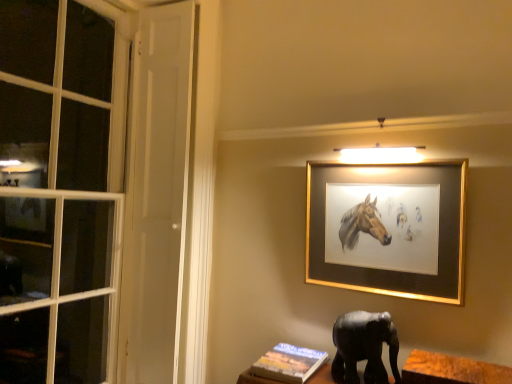
Question: Considering the positions of point (339, 319) and point (487, 369), is point (339, 319) closer or farther from the camera than point (487, 369)?

Choices:
 (A) closer
 (B) farther

Answer: (B)

Question: Is black matte elephant at lower right to the left or to the right of wooden at lower right in the image?

Choices:
 (A) right
 (B) left

Answer: (B)

Question: Which is nearer to the black matte elephant at lower right?

Choices:
 (A) gold-framed painting at upper center
 (B) wooden at lower right
 (C) hardcover book at lower center

Answer: (B)

Question: Considering the real-world distances, which object is closest to the hardcover book at lower center?

Choices:
 (A) black matte elephant at lower right
 (B) wooden at lower right
 (C) gold-framed painting at upper center

Answer: (A)